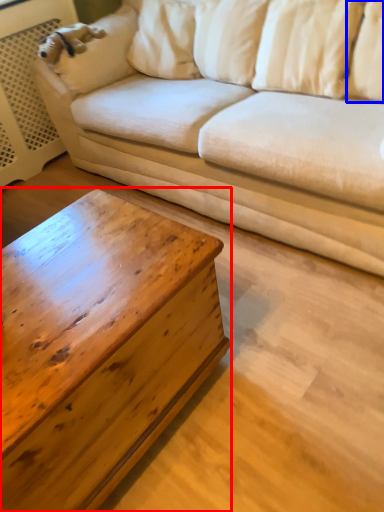
Question: Among these objects, which one is farthest to the camera, coffee table (highlighted by a red box) or pillow (highlighted by a blue box)?

Choices:
 (A) coffee table
 (B) pillow

Answer: (B)